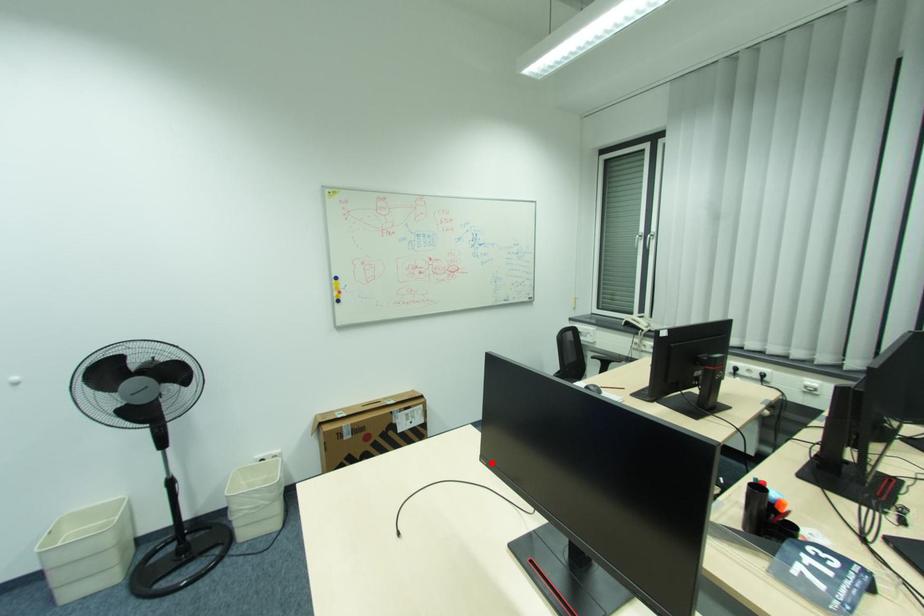
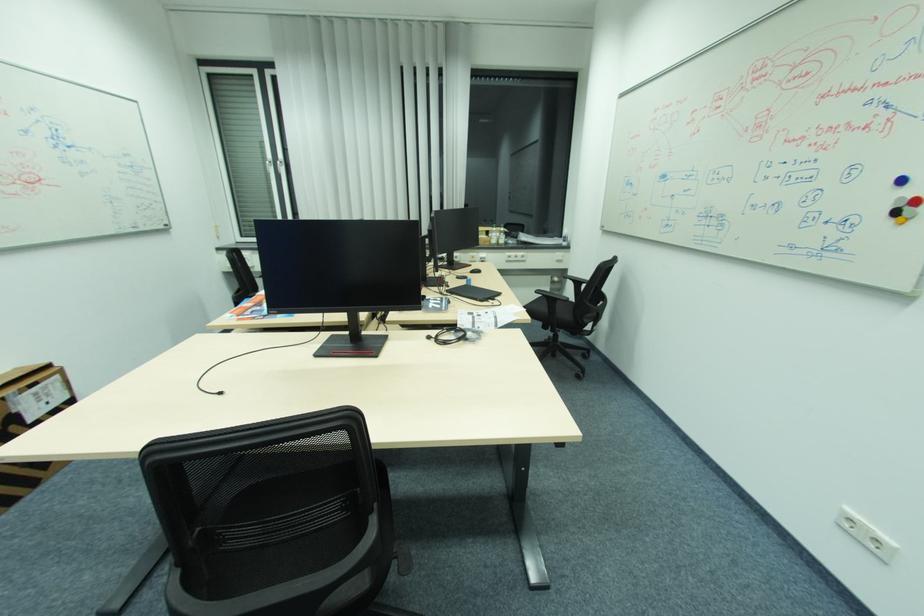
Where in the second image is the point corresponding to the highlighted location from the first image?

(282, 312)